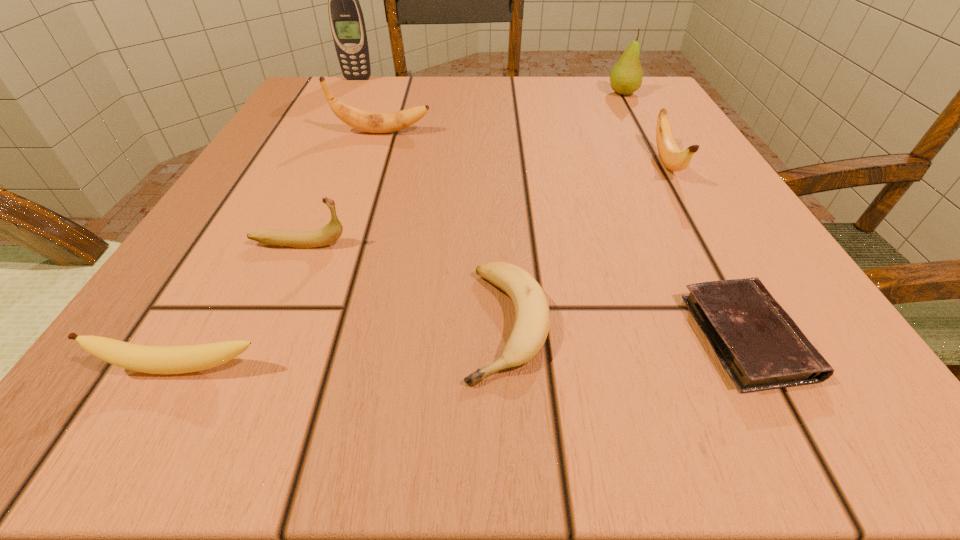
At what (x,y) coordinates should I click in order to perform the action: click on cellular telephone that is at the far edge. Please return your answer as a coordinate pair (x, y). Looking at the image, I should click on (347, 23).

Identify the location of pear that is at the far edge. The image size is (960, 540). (626, 76).

Locate an element on the screen. The height and width of the screenshot is (540, 960). banana that is at the far edge is located at coordinates (361, 120).

At what (x,y) coordinates should I click in order to perform the action: click on diary present at the near edge. Please return your answer as a coordinate pair (x, y). Looking at the image, I should click on (759, 345).

Find the location of a particular element. This screenshot has height=540, width=960. cellular telephone present at the left edge is located at coordinates (347, 23).

At what (x,y) coordinates should I click in order to perform the action: click on pear present at the right edge. Please return your answer as a coordinate pair (x, y). This screenshot has height=540, width=960. Looking at the image, I should click on (626, 76).

Where is `banana located in the right edge section of the desktop`? The image size is (960, 540). banana located in the right edge section of the desktop is located at coordinates (674, 159).

You are a GUI agent. You are given a task and a screenshot of the screen. Output one action in this format:
    pyautogui.click(x=<x>, y=<y>)
    Task: Click on the diary present at the right edge
    The height and width of the screenshot is (540, 960).
    Given the screenshot: What is the action you would take?
    pyautogui.click(x=759, y=345)

What are the coordinates of `cellular telephone that is at the far left corner` in the screenshot? It's located at (347, 23).

The width and height of the screenshot is (960, 540). What are the coordinates of `banana at the far left corner` in the screenshot? It's located at (361, 120).